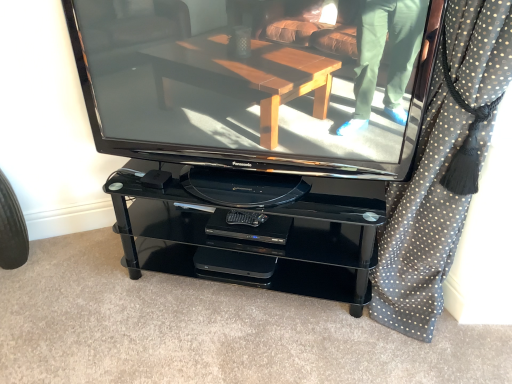
Question: Is black rubber tire at lower left surrounded by black dotted fabric at right?

Choices:
 (A) yes
 (B) no

Answer: (B)

Question: From the image's perspective, is black dotted fabric at right located beneath black rubber tire at lower left?

Choices:
 (A) yes
 (B) no

Answer: (B)

Question: Is black dotted fabric at right behind black rubber tire at lower left?

Choices:
 (A) yes
 (B) no

Answer: (B)

Question: Is black dotted fabric at right far from black rubber tire at lower left?

Choices:
 (A) no
 (B) yes

Answer: (B)

Question: Can you see black dotted fabric at right touching black rubber tire at lower left?

Choices:
 (A) no
 (B) yes

Answer: (A)

Question: From a real-world perspective, is black dotted fabric at right beneath black rubber tire at lower left?

Choices:
 (A) no
 (B) yes

Answer: (A)

Question: Is matte black television at center at the left side of black dotted fabric at right?

Choices:
 (A) no
 (B) yes

Answer: (B)

Question: Is matte black television at center positioned before black dotted fabric at right?

Choices:
 (A) yes
 (B) no

Answer: (B)

Question: Could you tell me if matte black television at center is facing black dotted fabric at right?

Choices:
 (A) yes
 (B) no

Answer: (B)

Question: From the image's perspective, does matte black television at center appear lower than black dotted fabric at right?

Choices:
 (A) yes
 (B) no

Answer: (B)

Question: Is black dotted fabric at right inside matte black television at center?

Choices:
 (A) no
 (B) yes

Answer: (A)

Question: Is matte black television at center far away from black dotted fabric at right?

Choices:
 (A) yes
 (B) no

Answer: (B)

Question: Is black dotted fabric at right completely or partially outside of matte black television at center?

Choices:
 (A) no
 (B) yes

Answer: (B)